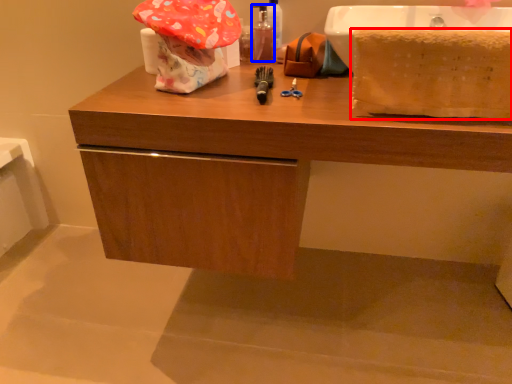
Question: Among these objects, which one is nearest to the camera, blanket (highlighted by a red box) or mouthwash (highlighted by a blue box)?

Choices:
 (A) blanket
 (B) mouthwash

Answer: (A)